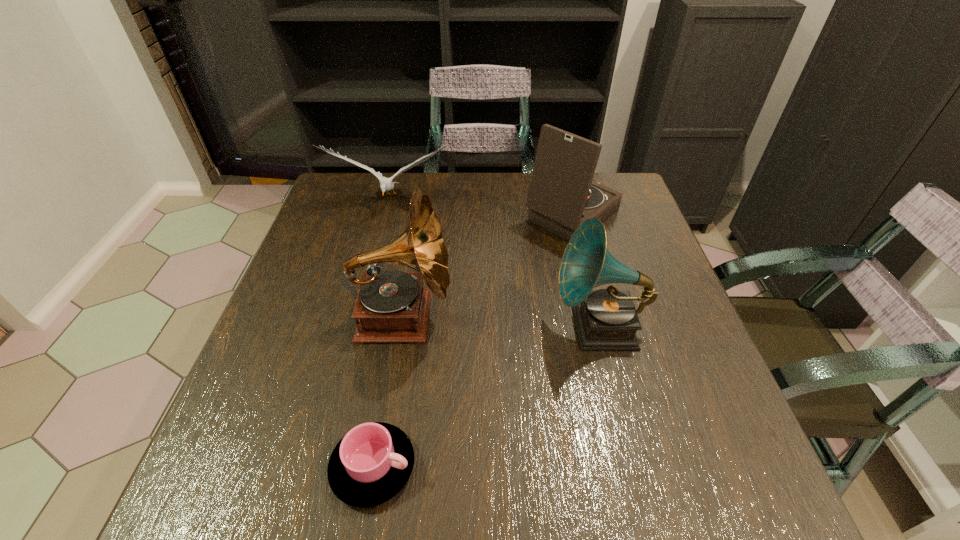
Find the location of `the leftmost phonograph_record`. the leftmost phonograph_record is located at coordinates (391, 306).

Locate an element on the screen. the farthest phonograph_record is located at coordinates (562, 195).

You are a GUI agent. You are given a task and a screenshot of the screen. Output one action in this format:
    pyautogui.click(x=<x>, y=<y>)
    Task: Click on the second shortest object
    Image resolution: width=960 pixels, height=540 pixels.
    Given the screenshot: What is the action you would take?
    pyautogui.click(x=386, y=184)

At what (x,y) coordinates should I click in order to perform the action: click on cup. Please return your answer as a coordinate pair (x, y). This screenshot has height=540, width=960. Looking at the image, I should click on (371, 464).

This screenshot has width=960, height=540. I want to click on the nearest object, so click(x=371, y=464).

At what (x,y) coordinates should I click in order to perform the action: click on vacant space located 0.080m on the horn of the leftmost phonograph_record. Please return your answer as a coordinate pair (x, y). Looking at the image, I should click on (489, 317).

At what (x,y) coordinates should I click in order to perform the action: click on free space located 0.370m on the front of the farthest phonograph_record. Please return your answer as a coordinate pair (x, y). The height and width of the screenshot is (540, 960). Looking at the image, I should click on (612, 370).

Find the location of a particular element. The width and height of the screenshot is (960, 540). free region located at the tip of the beak of the second shortest object is located at coordinates (368, 293).

Find the location of a particular element. vacant point located 0.070m on the side with the handle of the shortest object is located at coordinates (458, 467).

Locate an element on the screen. This screenshot has height=540, width=960. phonograph record that is at the far edge is located at coordinates (562, 195).